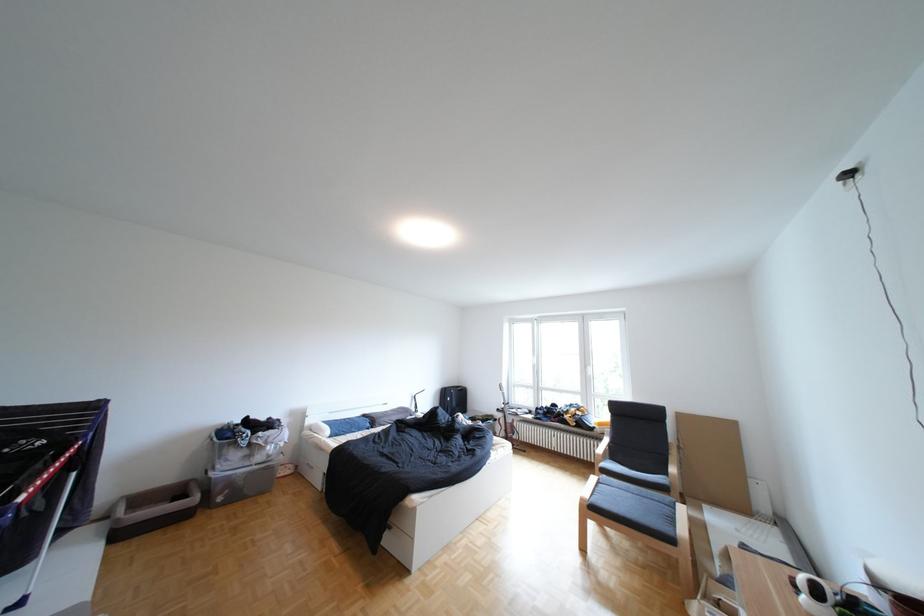
I want to click on chair armrest, so click(579, 456).